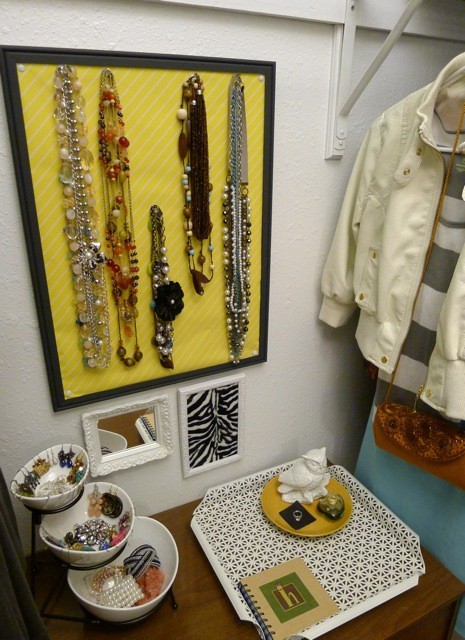
This screenshot has width=465, height=640. Identify the location of table. (188, 600).